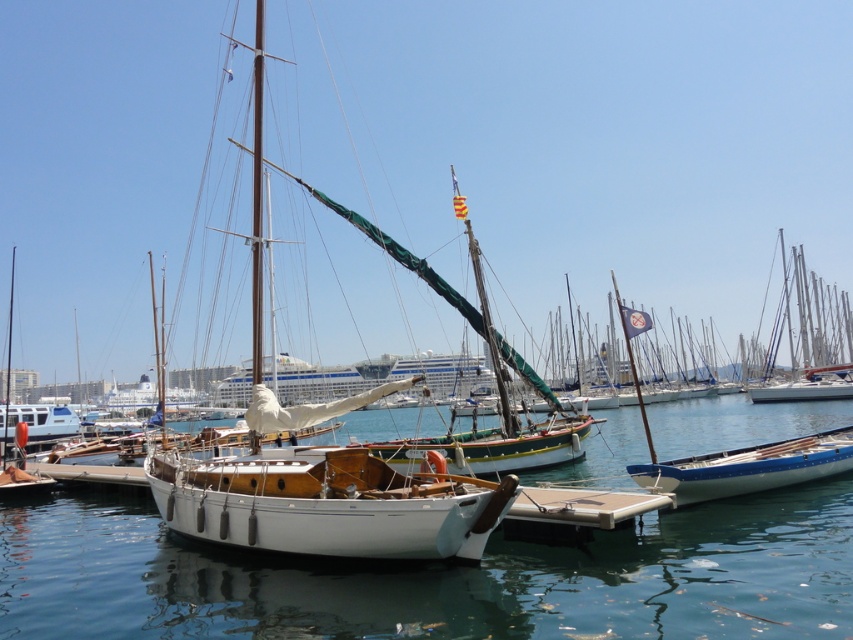
You are standing on the dock and see the clear blue water at center and the white glossy boat at lower right. Which object is located to the right of the other?

The clear blue water at center is positioned on the right side of white glossy boat at lower right, so the clear blue water at center is to the right of the white glossy boat at lower right.

You are standing on the dock and looking at the clear blue water at center and the white glossy boat at lower right. Which object appears bigger in the scene?

The clear blue water at center appears bigger than the white glossy boat at lower right because it has a larger size compared to the boat.